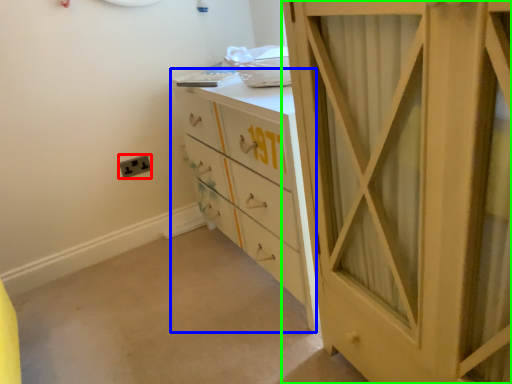
Question: Which object is positioned closest to electric outlet (highlighted by a red box)? Select from chest of drawers (highlighted by a blue box) and cupboard (highlighted by a green box).

Choices:
 (A) chest of drawers
 (B) cupboard

Answer: (A)